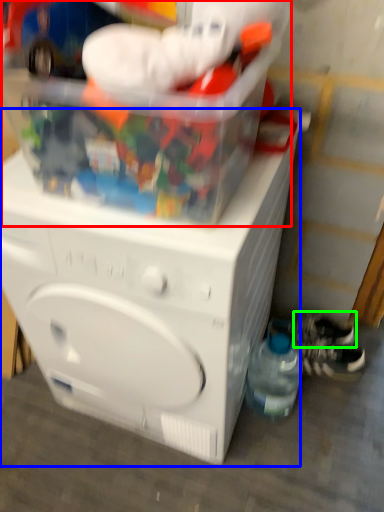
Question: Which is farther away from toy (highlighted by a red box)? washing machine (highlighted by a blue box) or shoe (highlighted by a green box)?

Choices:
 (A) washing machine
 (B) shoe

Answer: (B)